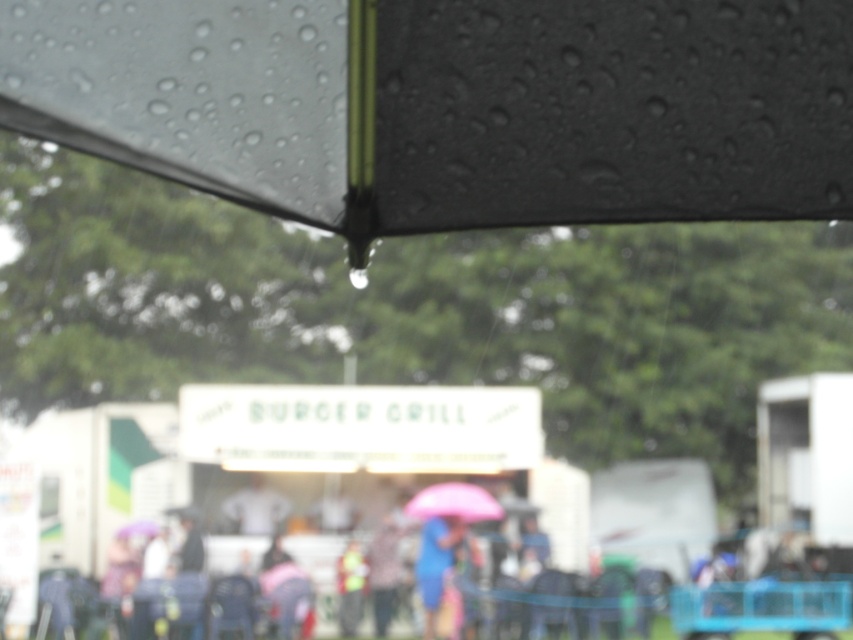
You are a photographer trying to capture a shot of both the black matte umbrella at upper center and the blue fabric umbrella at center. Given that your camera can focus on objects up to 50 feet away, will you be able to capture both clearly in the same frame?

The black matte umbrella at upper center is 74.22 feet away from the blue fabric umbrella at center. Since the camera can only focus up to 50 feet, the distance between them exceeds the camera range. Therefore, you cannot capture both clearly in the same frame.

From the picture: You are standing under the black matte umbrella at upper center and want to reach into your pocket to get your phone. Considering the umbrella is 1.58 meters away from you, can you comfortably do this without moving the umbrella?

The black matte umbrella at upper center is 1.58 meters away from the viewer, so you can comfortably reach into your pocket to get your phone without needing to move the umbrella since the distance allows for easy access.

You are standing under the pink matte umbrella at center and want to see the BURGER GRILL food stall clearly. Can you see it without moving the blue fabric umbrella at center?

The blue fabric umbrella at center is positioned under the pink matte umbrella at center, so it is blocking your view of the BURGER GRILL food stall. You will need to move the blue fabric umbrella at center to see it clearly.